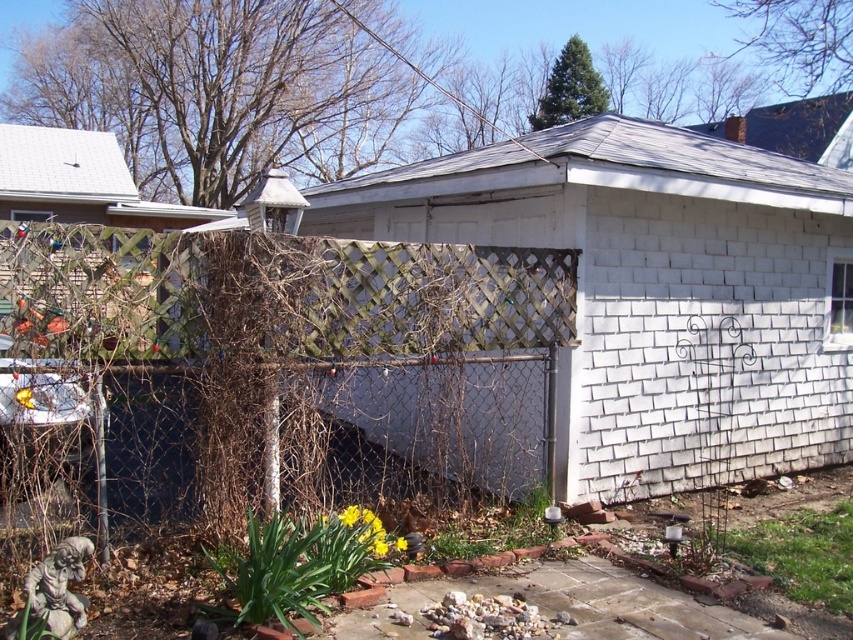
Is wooden lattice fence at left taller than yellow matte flower at lower center?

Yes.

Is point (85, 241) in front of point (383, 552)?

Yes, point (85, 241) is closer to viewer.

This screenshot has height=640, width=853. What are the coordinates of `wooden lattice fence at left` in the screenshot? It's located at (300, 356).